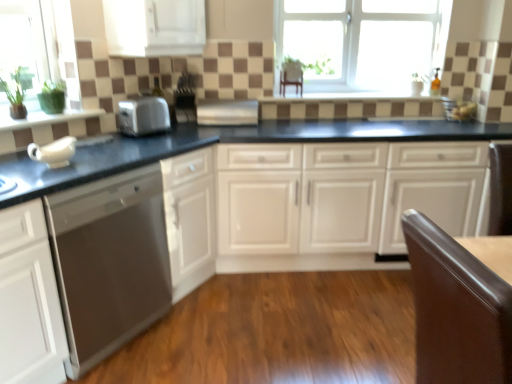
This screenshot has height=384, width=512. What are the coordinates of `free location above satin silver toaster at center (from a real-world perspective)` in the screenshot? It's located at (137, 101).